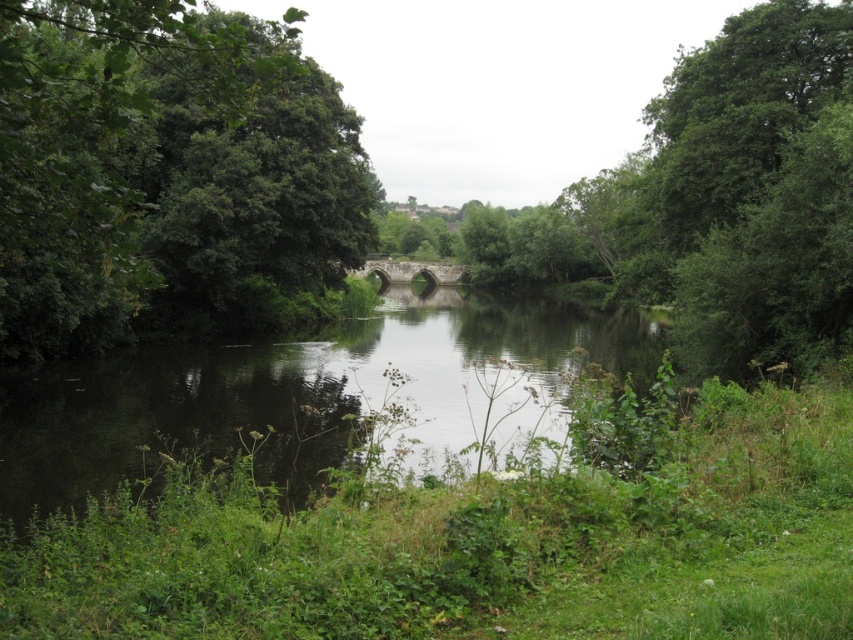
Question: Which object is closer to the camera taking this photo?

Choices:
 (A) dark reflective water at center
 (B) green leafy tree at left

Answer: (B)

Question: Can you confirm if green leafy tree at left is thinner than dark reflective water at center?

Choices:
 (A) no
 (B) yes

Answer: (B)

Question: Can you confirm if green leafy tree at left is bigger than dark reflective water at center?

Choices:
 (A) yes
 (B) no

Answer: (B)

Question: Which of the following is the farthest from the observer?

Choices:
 (A) dark reflective water at center
 (B) green leafy tree at left

Answer: (A)

Question: Among these points, which one is farthest from the camera?

Choices:
 (A) (561, 336)
 (B) (277, 272)

Answer: (A)

Question: Can you confirm if green leafy tree at left is thinner than dark reflective water at center?

Choices:
 (A) yes
 (B) no

Answer: (A)